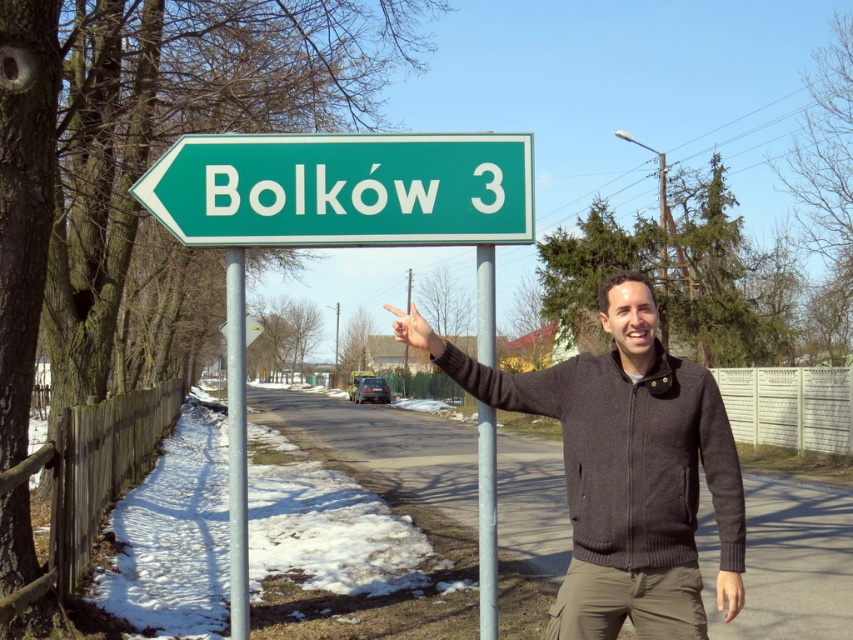
Question: Based on their relative distances, which object is farther from the metallic gray pole at center?

Choices:
 (A) dark gray sweater at center
 (B) green plastic sign at left
 (C) metallic pole at left
 (D) green plastic sign at upper left

Answer: (D)

Question: Is the position of dark gray sweater at center less distant than that of metallic gray pole at center?

Choices:
 (A) no
 (B) yes

Answer: (B)

Question: Observing the image, what is the correct spatial positioning of metallic gray pole at center in reference to green plastic sign at upper left?

Choices:
 (A) right
 (B) left

Answer: (A)

Question: Is metallic gray pole at center to the left of green plastic sign at upper left from the viewer's perspective?

Choices:
 (A) no
 (B) yes

Answer: (A)

Question: Which of the following is the closest to the observer?

Choices:
 (A) green plastic sign at upper left
 (B) green plastic sign at left
 (C) metallic gray pole at center
 (D) dark gray sweater at center

Answer: (D)

Question: Which object is farther from the camera taking this photo?

Choices:
 (A) metallic gray pole at center
 (B) metallic pole at left
 (C) green plastic sign at upper left

Answer: (B)